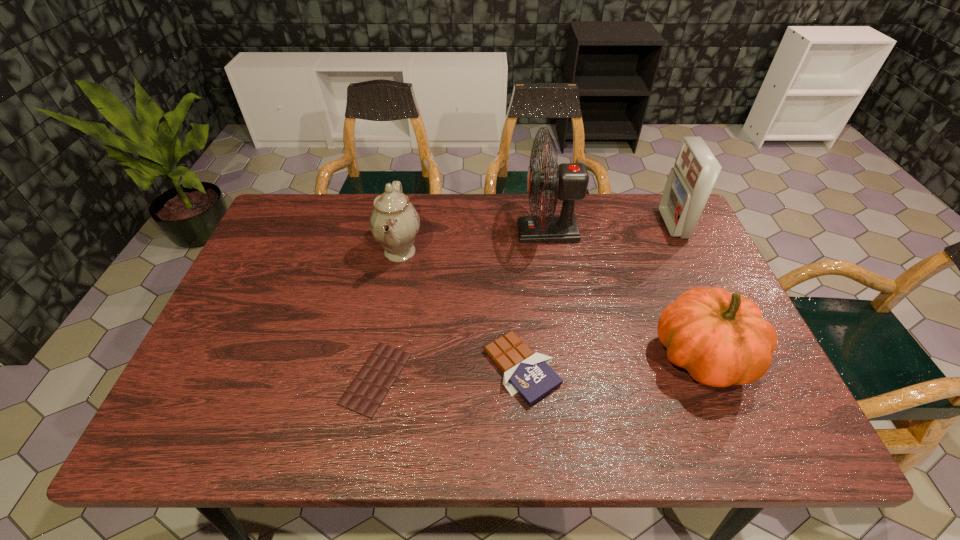
Where is `vacant area that lies between the tallest object and the pumpkin`? This screenshot has width=960, height=540. vacant area that lies between the tallest object and the pumpkin is located at coordinates (625, 294).

Where is `free spot between the tallest object and the taller chocolate bar`? This screenshot has height=540, width=960. free spot between the tallest object and the taller chocolate bar is located at coordinates (535, 300).

You are a GUI agent. You are given a task and a screenshot of the screen. Output one action in this format:
    pyautogui.click(x=<x>, y=<y>)
    Task: Click on the vacant region between the first-aid kit and the pumpkin
    Image resolution: width=960 pixels, height=540 pixels.
    Given the screenshot: What is the action you would take?
    pyautogui.click(x=687, y=291)

This screenshot has width=960, height=540. I want to click on empty space between the chinaware and the shorter chocolate bar, so click(388, 315).

The height and width of the screenshot is (540, 960). I want to click on free space that is in between the pumpkin and the first-aid kit, so pos(687,291).

Find the location of `free spot between the fifth tallest object and the tallest object`. free spot between the fifth tallest object and the tallest object is located at coordinates [535, 300].

Where is `empty location between the fan and the chinaware`? empty location between the fan and the chinaware is located at coordinates (474, 242).

Where is `blank region between the right chocolate bar and the tallest object`? The height and width of the screenshot is (540, 960). blank region between the right chocolate bar and the tallest object is located at coordinates (535, 300).

Choose which object is the fifth nearest neighbor to the chinaware. Please provide its 2D coordinates. Your answer should be formatted as a tuple, i.e. [(x, y)], where the tuple contains the x and y coordinates of a point satisfying the conditions above.

[(690, 182)]

What are the coordinates of `object that stands as the closest to the pumpkin` in the screenshot? It's located at [x=569, y=182].